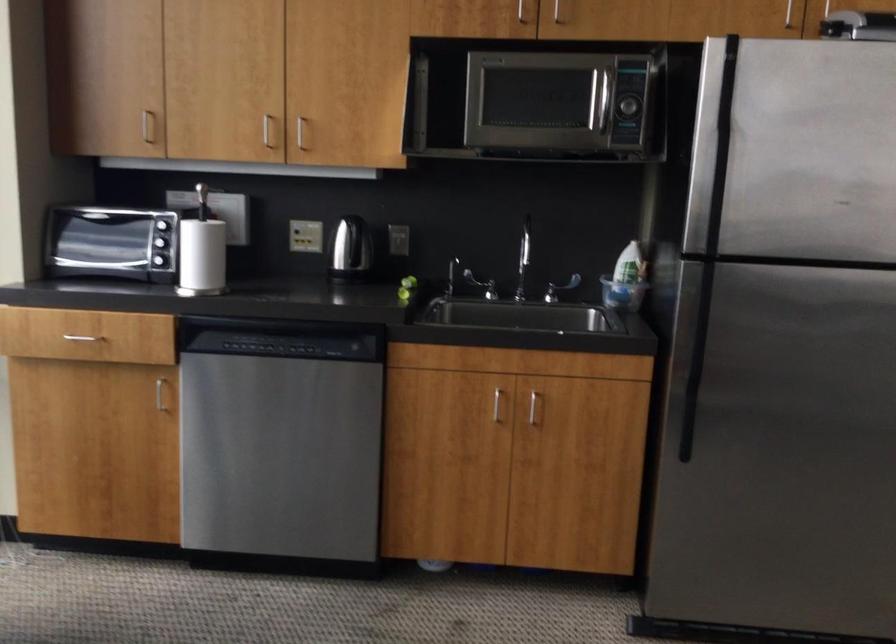
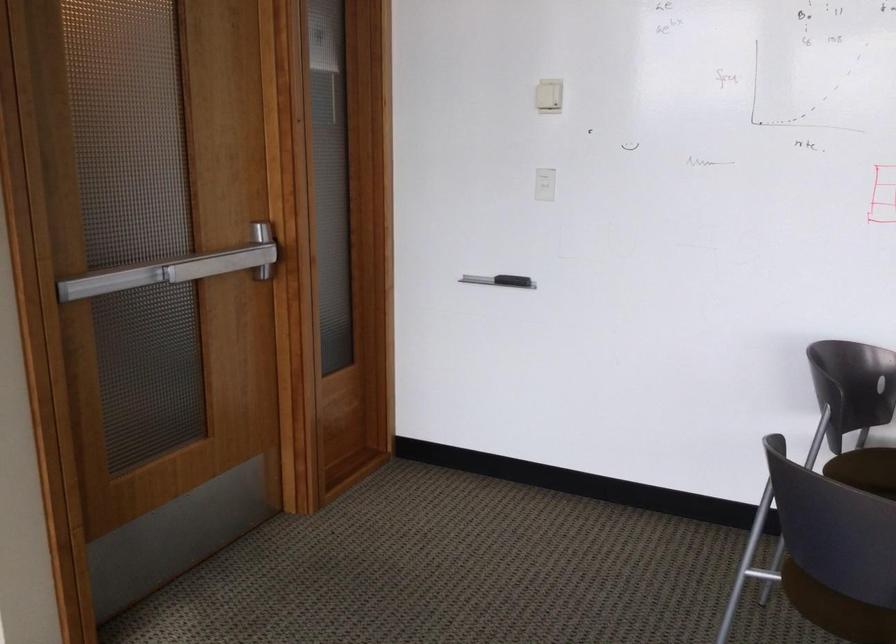
Question: How did the camera likely rotate?

Choices:
 (A) Left
 (B) Right
 (C) Up
 (D) Down

Answer: (B)